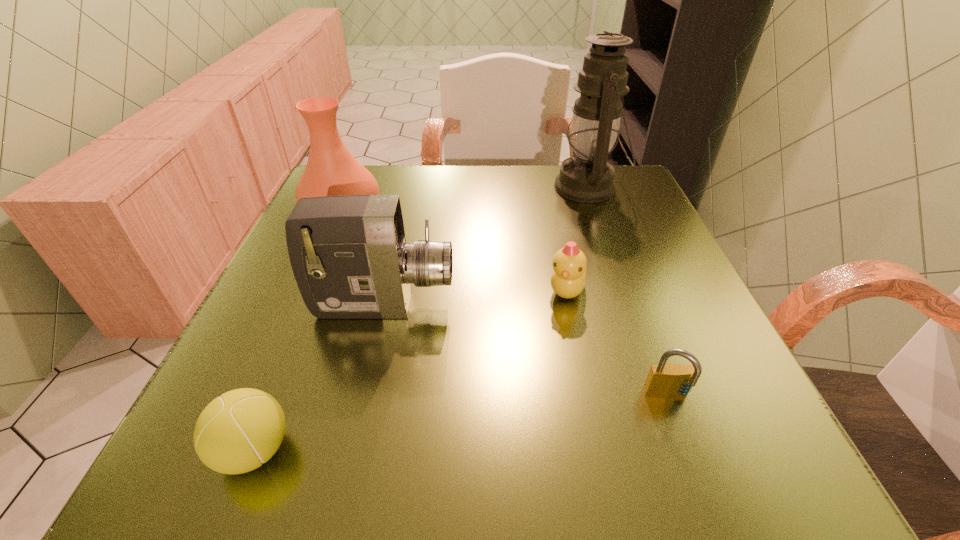
Identify the location of free space between the padlock and the nearest object. (461, 424).

Where is `free space between the duckling and the tallest object`? The height and width of the screenshot is (540, 960). free space between the duckling and the tallest object is located at coordinates (577, 239).

I want to click on free space between the second nearest object and the nearest object, so click(461, 424).

The width and height of the screenshot is (960, 540). I want to click on free spot between the oil lamp and the tennis ball, so click(421, 319).

The width and height of the screenshot is (960, 540). Find the location of `unoccupied area between the nearest object and the fifth shortest object`. unoccupied area between the nearest object and the fifth shortest object is located at coordinates (299, 332).

Where is `free spot between the vase and the oil lamp`? The width and height of the screenshot is (960, 540). free spot between the vase and the oil lamp is located at coordinates (466, 200).

Where is `vacant area between the tallest object and the padlock`? This screenshot has height=540, width=960. vacant area between the tallest object and the padlock is located at coordinates (628, 293).

This screenshot has width=960, height=540. Find the location of `empty space between the tallest object and the padlock`. empty space between the tallest object and the padlock is located at coordinates (628, 293).

At what (x,y) coordinates should I click in order to perform the action: click on the fourth closest object to the oil lamp. Please return your answer as a coordinate pair (x, y). The image size is (960, 540). Looking at the image, I should click on (664, 380).

Locate which object is the fourth closest to the tallest object. Please provide its 2D coordinates. Your answer should be formatted as a tuple, i.e. [(x, y)], where the tuple contains the x and y coordinates of a point satisfying the conditions above.

[(664, 380)]